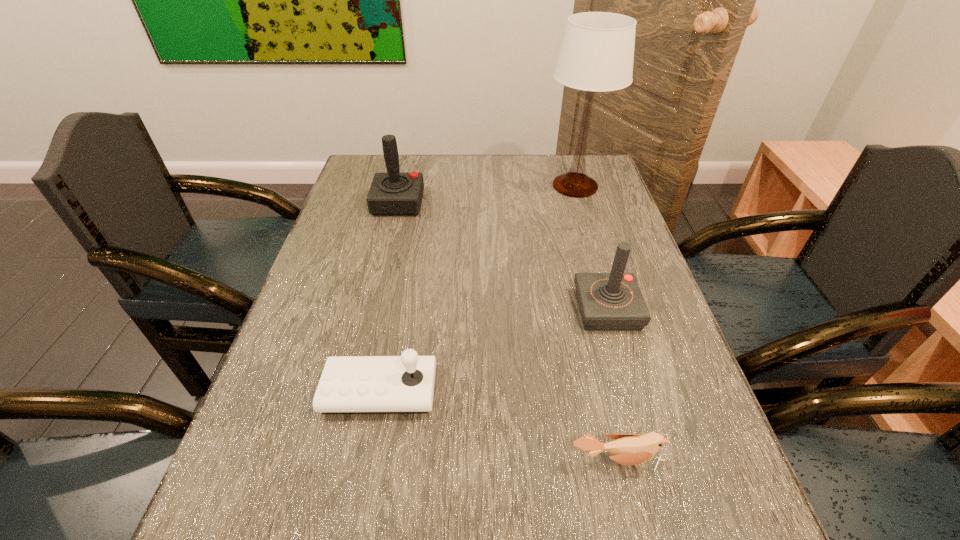
Identify the location of vacant space located above the cylindrical shade of the tallest object. The height and width of the screenshot is (540, 960). (490, 186).

At what (x,y) coordinates should I click in order to perform the action: click on free space located 0.360m on the base of the farthest joystick. Please return your answer as a coordinate pair (x, y). The image size is (960, 540). Looking at the image, I should click on (541, 204).

Where is `vacant region located 0.120m on the rectangular base of the second nearest joystick`? The width and height of the screenshot is (960, 540). vacant region located 0.120m on the rectangular base of the second nearest joystick is located at coordinates (525, 310).

What are the coordinates of `blank area located on the rectangular base of the second nearest joystick` in the screenshot? It's located at (429, 310).

Locate an element on the screen. The width and height of the screenshot is (960, 540). free space located 0.120m on the rectangular base of the second nearest joystick is located at coordinates (525, 310).

Where is `vacant area situated on the right of the nearest joystick`? The height and width of the screenshot is (540, 960). vacant area situated on the right of the nearest joystick is located at coordinates (604, 391).

Where is `vacant area located at the beak of the nearest object`? This screenshot has height=540, width=960. vacant area located at the beak of the nearest object is located at coordinates (631, 520).

You are a GUI agent. You are given a task and a screenshot of the screen. Output one action in this format:
    pyautogui.click(x=<x>, y=<y>)
    Task: Click on the table lamp that is at the far edge
    
    Given the screenshot: What is the action you would take?
    pyautogui.click(x=597, y=52)

Locate an element on the screen. The image size is (960, 540). joystick positioned at the far edge is located at coordinates point(393,193).

Where is `table lamp at the right edge`? The height and width of the screenshot is (540, 960). table lamp at the right edge is located at coordinates (597, 52).